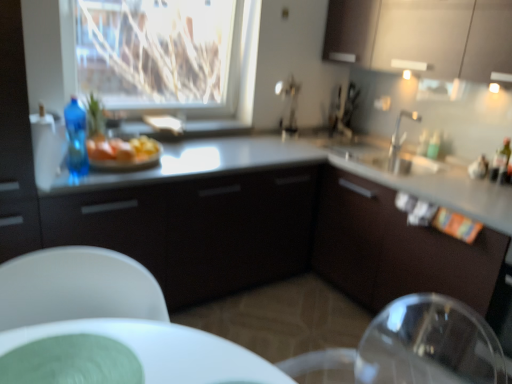
Identify the location of vacant space to the right of yellow butter at center. Image resolution: width=512 pixels, height=384 pixels. (181, 164).